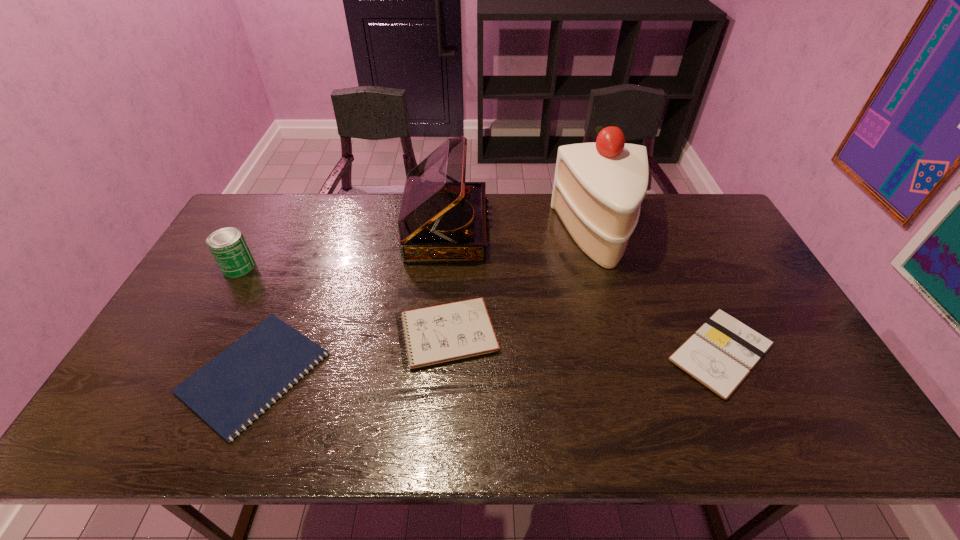
Image resolution: width=960 pixels, height=540 pixels. Find the location of `object positioned at the right edge`. object positioned at the right edge is located at coordinates (721, 353).

At what (x,y) coordinates should I click in order to perform the action: click on object that is at the near left corner. Please return your answer as a coordinate pair (x, y). Image resolution: width=960 pixels, height=540 pixels. Looking at the image, I should click on (259, 368).

Where is `vacant space at the far edge of the desktop`? The height and width of the screenshot is (540, 960). vacant space at the far edge of the desktop is located at coordinates (488, 232).

The height and width of the screenshot is (540, 960). Find the location of `free region at the near edge`. free region at the near edge is located at coordinates (645, 424).

This screenshot has height=540, width=960. What are the coordinates of `free region at the left edge` in the screenshot? It's located at (166, 389).

The width and height of the screenshot is (960, 540). I want to click on free region at the right edge, so click(x=739, y=291).

Image resolution: width=960 pixels, height=540 pixels. I want to click on vacant space at the far left corner of the desktop, so click(270, 197).

At what (x,y) coordinates should I click in order to perform the action: click on vacant region at the near right corner of the desktop. Please return your answer as a coordinate pair (x, y). This screenshot has width=960, height=540. Looking at the image, I should click on (805, 413).

Identify the location of vacant space that's between the third tallest object and the fifth shortest object. This screenshot has height=540, width=960. (343, 248).

Find the location of a particular element. empty space between the third shortest object and the shortest object is located at coordinates (350, 353).